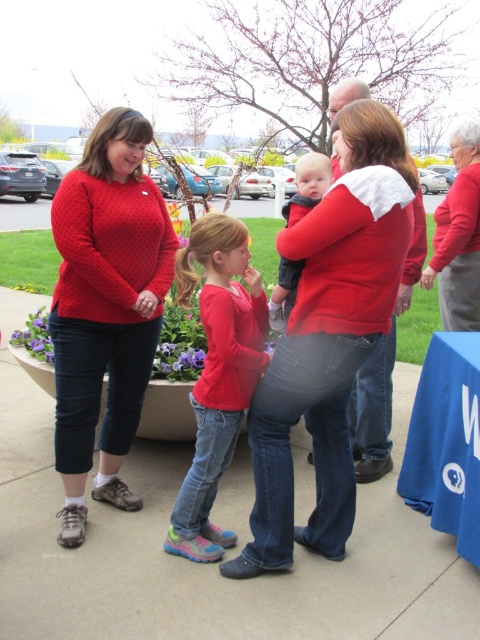
You are at a community event and see two people wearing the matte red shirt at center and the soft gray knit sweater at center. Which one is positioned more to the left side?

The matte red shirt at center is positioned more to the left side than the soft gray knit sweater at center.

Consider the image. You are standing at the entrance of the paved area and want to find the matte red sweater at center. According to the coordinates provided, in which direction should you move relative to your current position?

The matte red sweater at center is located at coordinates point (384, 368). Since the coordinate system typically has (0, 0) at the bottom left corner, moving towards the right and slightly upwards from the entrance would lead you to the sweater.

You are a photographer trying to capture a clear shot of the matte red shirt at center and the soft gray knit sweater at center. Which one is blocking the other from being fully visible?

The matte red shirt at center is blocking the soft gray knit sweater at center because it is in front of it.